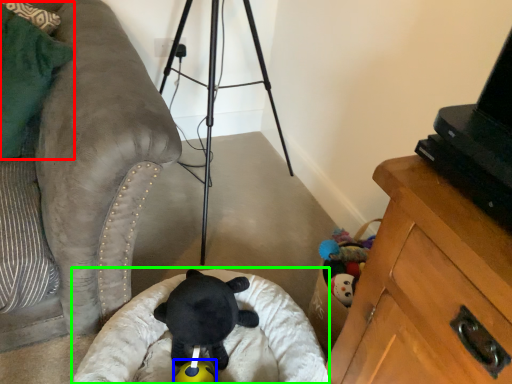
Question: Based on their relative distances, which object is nearer to pillow (highlighted by a red box)? Choose from toy (highlighted by a blue box) and infant bed (highlighted by a green box).

Choices:
 (A) toy
 (B) infant bed

Answer: (B)